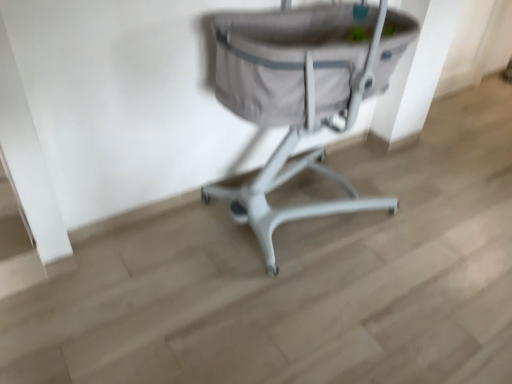
Identify the location of empty space that is to the right of white plastic baby swing at center. The image size is (512, 384). (430, 225).